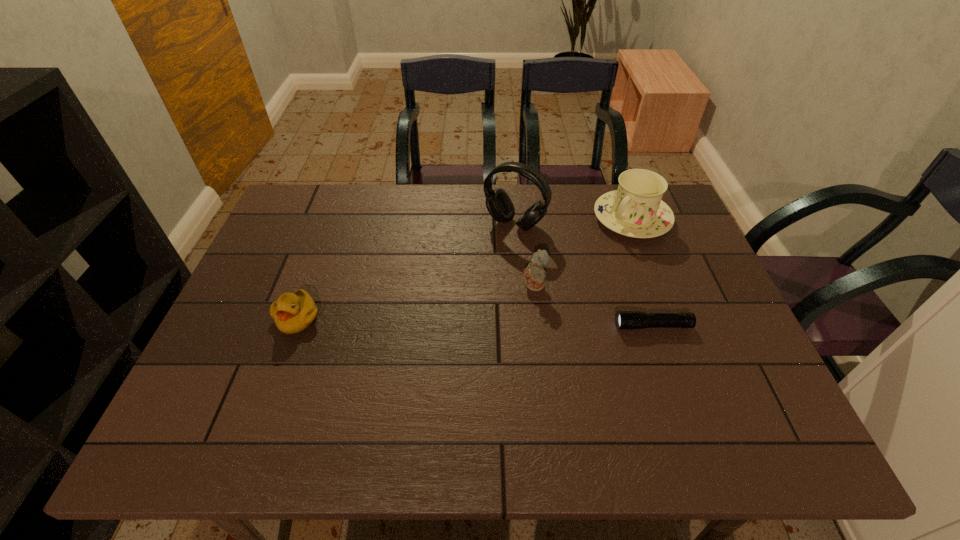
I want to click on headset that is at the far edge, so click(499, 205).

You are a GUI agent. You are given a task and a screenshot of the screen. Output one action in this format:
    pyautogui.click(x=<x>, y=<y>)
    Task: Click on the object located at the left edge
    This screenshot has width=960, height=540.
    Given the screenshot: What is the action you would take?
    pyautogui.click(x=293, y=312)

Where is `flashlight present at the right edge`? Image resolution: width=960 pixels, height=540 pixels. flashlight present at the right edge is located at coordinates (625, 320).

At what (x,y) coordinates should I click in order to perform the action: click on chinaware that is at the right edge. Please return your answer as a coordinate pair (x, y). Looking at the image, I should click on (636, 210).

Find the location of a particular element. Image resolution: width=960 pixels, height=540 pixels. object that is positioned at the far right corner is located at coordinates click(636, 210).

In the image, there is a desktop. Where is `vacant space at the far edge`? vacant space at the far edge is located at coordinates (524, 199).

Locate an element on the screen. The width and height of the screenshot is (960, 540). vacant region at the near edge of the desktop is located at coordinates (650, 388).

Find the location of `vacant area at the left edge`. vacant area at the left edge is located at coordinates (272, 325).

You are a GUI agent. You are given a task and a screenshot of the screen. Output one action in this format:
    pyautogui.click(x=<x>, y=<y>)
    Task: Click on the vacant space at the right edge
    The height and width of the screenshot is (540, 960).
    Given the screenshot: What is the action you would take?
    pyautogui.click(x=669, y=235)

Where is `free space at the near right corner of the desktop`? The height and width of the screenshot is (540, 960). free space at the near right corner of the desktop is located at coordinates (731, 371).